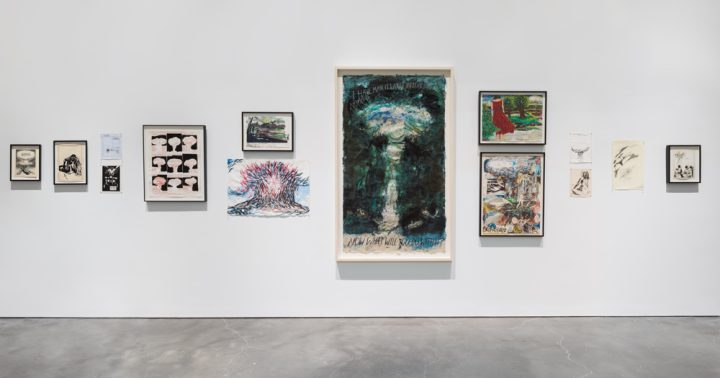
Identify the location of art pieces. This screenshot has width=720, height=378. click(x=158, y=164).